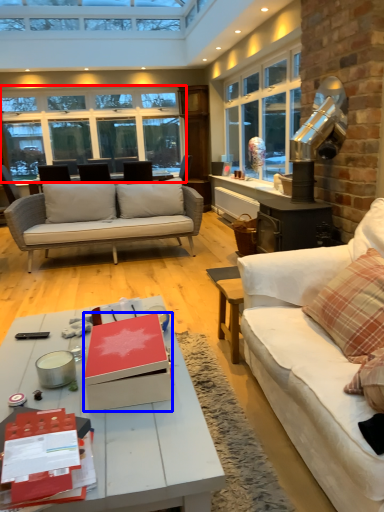
Question: Which of the following is the farthest to the observer, window (highlighted by a red box) or box (highlighted by a blue box)?

Choices:
 (A) window
 (B) box

Answer: (A)